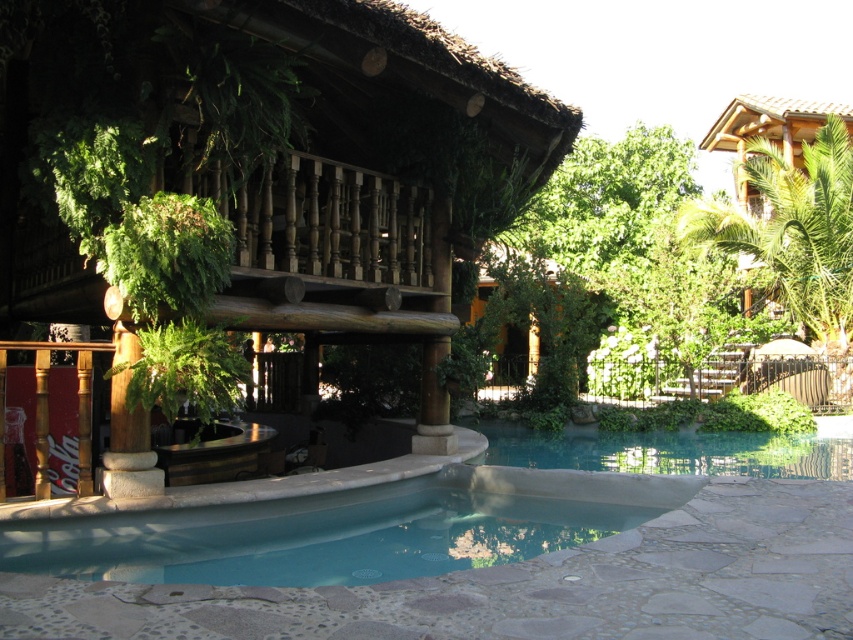
Does wooden balcony at center have a lesser width compared to smooth concrete pool at center?

Yes, wooden balcony at center is thinner than smooth concrete pool at center.

Does point (386, 125) lie behind point (305, 580)?

Yes, it is behind point (305, 580).

Where is `wooden balcony at center`? Image resolution: width=853 pixels, height=640 pixels. wooden balcony at center is located at coordinates (279, 147).

Does point (102, 532) lie in front of point (827, 320)?

Yes, it is.

Is smooth concrete pool at center to the right of green leafy tree at upper right from the viewer's perspective?

Incorrect, smooth concrete pool at center is not on the right side of green leafy tree at upper right.

Does point (355, 515) lie in front of point (805, 268)?

Yes, it is.

Locate an element on the screen. This screenshot has height=640, width=853. smooth concrete pool at center is located at coordinates (350, 529).

Does point (596, 205) lie in front of point (827, 296)?

No, (596, 205) is further to viewer.

Is point (726, 328) farther from viewer compared to point (828, 204)?

Yes, point (726, 328) is farther from viewer.

Locate an element on the screen. The width and height of the screenshot is (853, 640). green leafy tree at center is located at coordinates (635, 241).